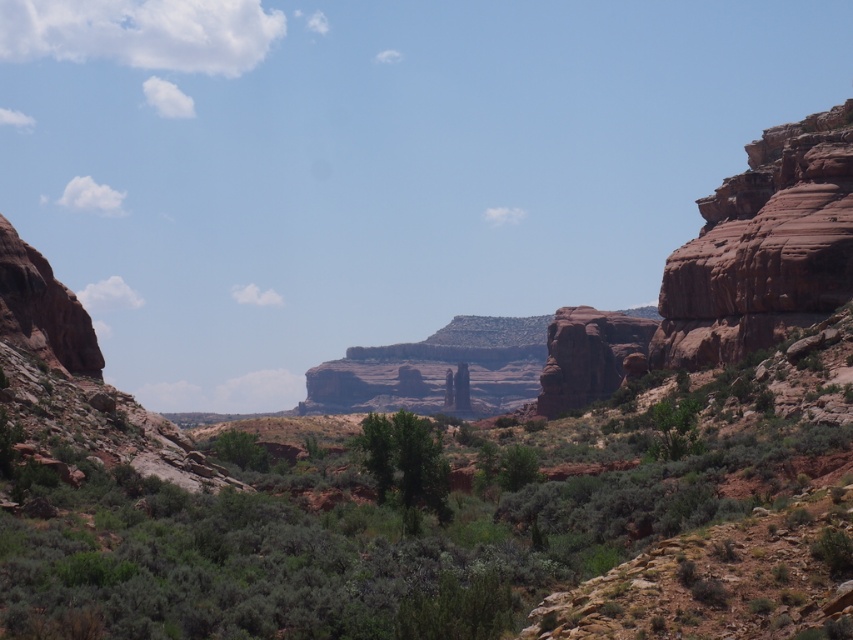
Between reddish-brown sedimentary rock at right and green leafy tree at center, which one appears on the right side from the viewer's perspective?

reddish-brown sedimentary rock at right is more to the right.

Does reddish-brown sedimentary rock at right have a greater width compared to green leafy tree at center?

Yes, reddish-brown sedimentary rock at right is wider than green leafy tree at center.

Is point (805, 202) less distant than point (379, 440)?

No, it is behind (379, 440).

The image size is (853, 640). In order to click on reddish-brown sedimentary rock at right in this screenshot , I will do `click(763, 248)`.

This screenshot has width=853, height=640. What do you see at coordinates (763, 248) in the screenshot?
I see `reddish-brown sedimentary rock at right` at bounding box center [763, 248].

Between reddish-brown sedimentary rock at right and rustic sandstone arch at center-right, which one has less height?

rustic sandstone arch at center-right is shorter.

Which is behind, point (827, 154) or point (625, 330)?

Positioned behind is point (625, 330).

Find the location of a particular element. reddish-brown sedimentary rock at right is located at coordinates (763, 248).

Between green shrubbery at center and rustic sandstone arch at center-right, which one is positioned higher?

Positioned higher is rustic sandstone arch at center-right.

Can you confirm if green shrubbery at center is shorter than rustic sandstone arch at center-right?

Yes, green shrubbery at center is shorter than rustic sandstone arch at center-right.

Is point (436, 636) farther from viewer compared to point (550, 378)?

No, it is in front of (550, 378).

At what (x,y) coordinates should I click in order to perform the action: click on green shrubbery at center. Please return your answer as a coordinate pair (x, y). This screenshot has height=640, width=853. Looking at the image, I should click on (434, 515).